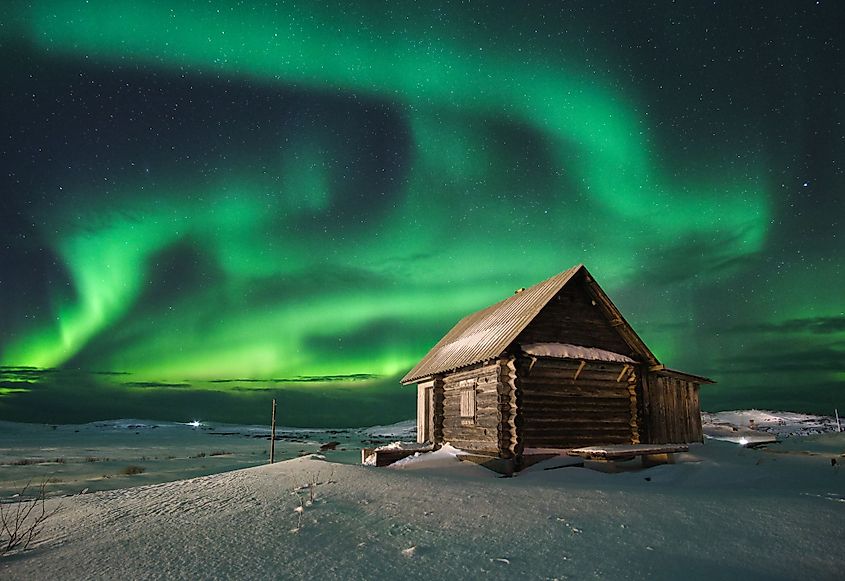
Find the location of `chimney`. chimney is located at coordinates (518, 290).